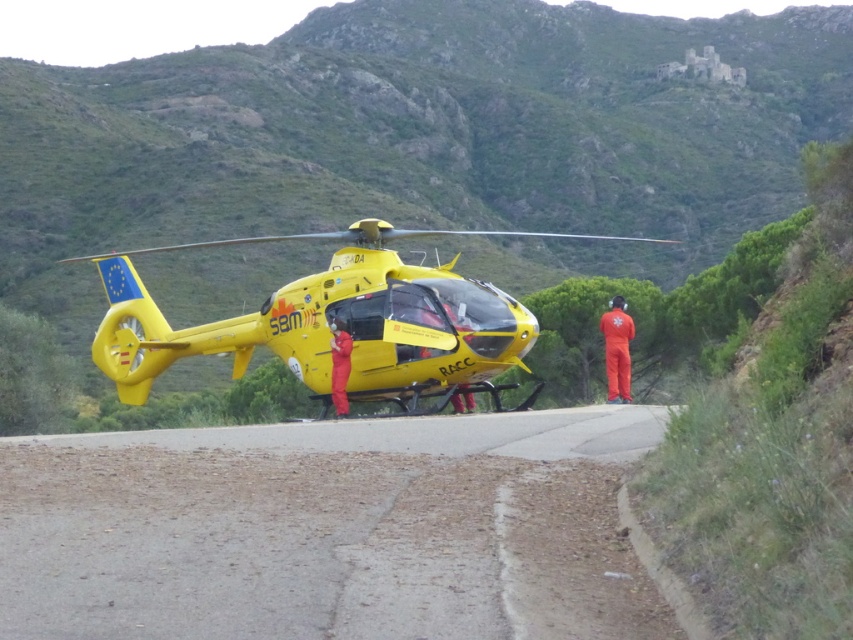
Can you confirm if asphalt road at center is positioned to the left of yellow-orange jumpsuit at center?

In fact, asphalt road at center is to the right of yellow-orange jumpsuit at center.

Is asphalt road at center shorter than yellow-orange jumpsuit at center?

Correct, asphalt road at center is not as tall as yellow-orange jumpsuit at center.

Does point (273, 627) come in front of point (332, 378)?

Yes.

Where is `asphalt road at center`? This screenshot has width=853, height=640. asphalt road at center is located at coordinates (328, 531).

Who is more distant from viewer, (430, 330) or (624, 339)?

Point (624, 339)

Is point (346, 260) more distant than point (630, 356)?

No, it is not.

Where is `yellow matte helicopter at center`? Image resolution: width=853 pixels, height=640 pixels. yellow matte helicopter at center is located at coordinates (332, 317).

Does point (466, 445) come closer to viewer compared to point (384, 260)?

Yes, point (466, 445) is closer to viewer.

Is asphalt road at center positioned at the back of yellow matte helicopter at center?

No.

Is point (520, 477) behind point (299, 346)?

No, (520, 477) is in front of (299, 346).

Identify the location of asphalt road at center. (328, 531).